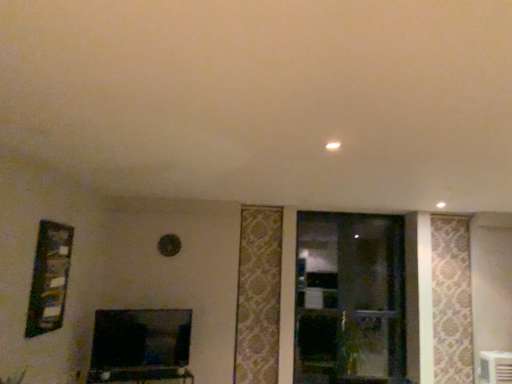
Question: From a real-world perspective, is green leafy plant at center below white plastic air conditioner at lower right?

Choices:
 (A) yes
 (B) no

Answer: (A)

Question: Is green leafy plant at center turned away from white plastic air conditioner at lower right?

Choices:
 (A) no
 (B) yes

Answer: (A)

Question: Does green leafy plant at center come behind white plastic air conditioner at lower right?

Choices:
 (A) no
 (B) yes

Answer: (B)

Question: Can you confirm if green leafy plant at center is positioned to the right of white plastic air conditioner at lower right?

Choices:
 (A) yes
 (B) no

Answer: (B)

Question: Is white plastic air conditioner at lower right inside green leafy plant at center?

Choices:
 (A) yes
 (B) no

Answer: (B)

Question: From a real-world perspective, is matte black tv stand at lower center above or below green leafy plant at center?

Choices:
 (A) below
 (B) above

Answer: (A)

Question: In terms of height, does matte black tv stand at lower center look taller or shorter compared to green leafy plant at center?

Choices:
 (A) tall
 (B) short

Answer: (B)

Question: Is matte black tv stand at lower center bigger or smaller than green leafy plant at center?

Choices:
 (A) small
 (B) big

Answer: (A)

Question: From the image's perspective, is matte black tv stand at lower center located above or below green leafy plant at center?

Choices:
 (A) below
 (B) above

Answer: (B)

Question: In terms of height, does transparent glass window at center look taller or shorter compared to matte black tv at lower center?

Choices:
 (A) short
 (B) tall

Answer: (B)

Question: Looking at their shapes, would you say transparent glass window at center is wider or thinner than matte black tv at lower center?

Choices:
 (A) thin
 (B) wide

Answer: (A)

Question: Does point (352, 322) appear closer or farther from the camera than point (124, 362)?

Choices:
 (A) farther
 (B) closer

Answer: (A)

Question: Visually, is transparent glass window at center positioned to the left or to the right of matte black tv at lower center?

Choices:
 (A) right
 (B) left

Answer: (A)

Question: Considering their positions, is transparent glass window at center located in front of or behind matte black tv stand at lower center?

Choices:
 (A) front
 (B) behind

Answer: (B)

Question: Which is correct: transparent glass window at center is inside matte black tv stand at lower center, or outside of it?

Choices:
 (A) outside
 (B) inside

Answer: (A)